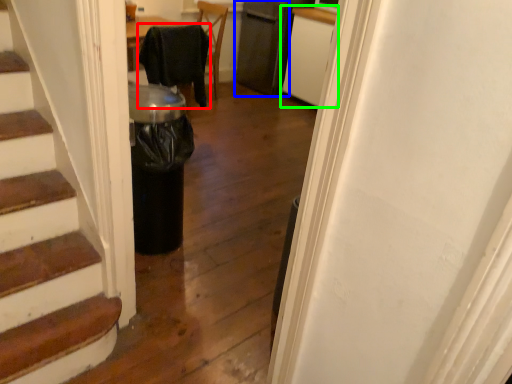
Question: Which is nearer to the chair (highlighted by a red box)? appliance (highlighted by a blue box) or cabinetry (highlighted by a green box).

Choices:
 (A) appliance
 (B) cabinetry

Answer: (B)